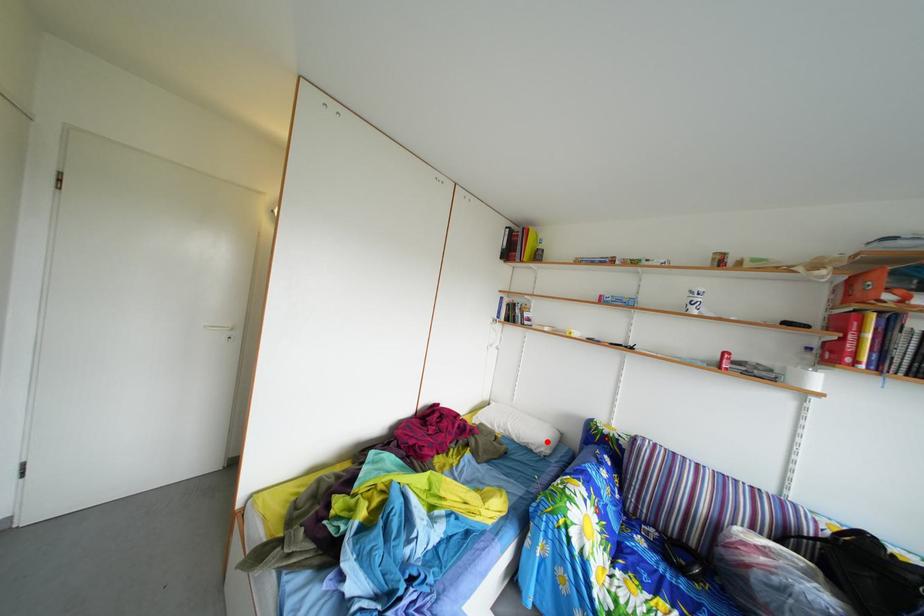
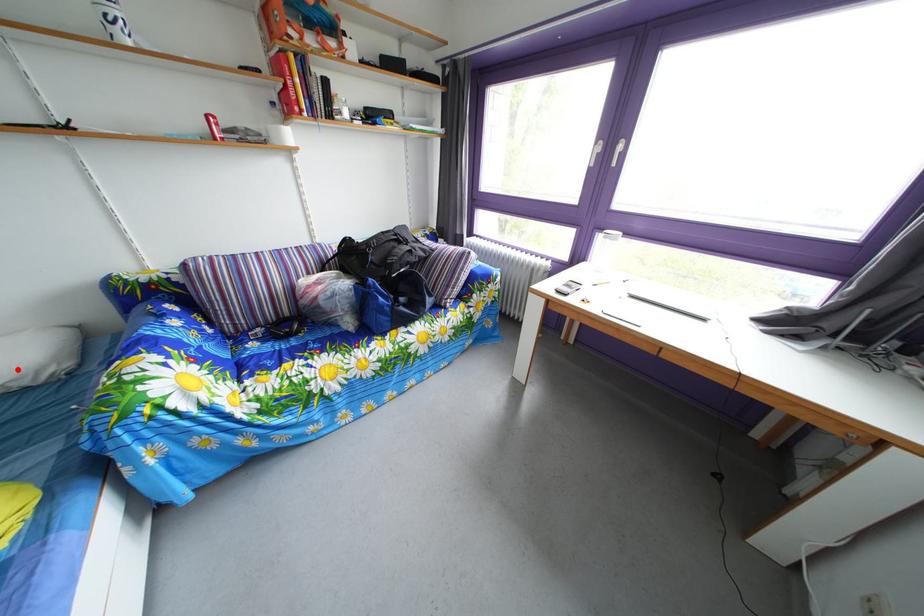
I am providing you with two images of the same scene from different viewpoints. A red point is marked on the first image and another point is marked on the second image. Are the points marked in image1 and image2 representing the same 3D position?

Yes